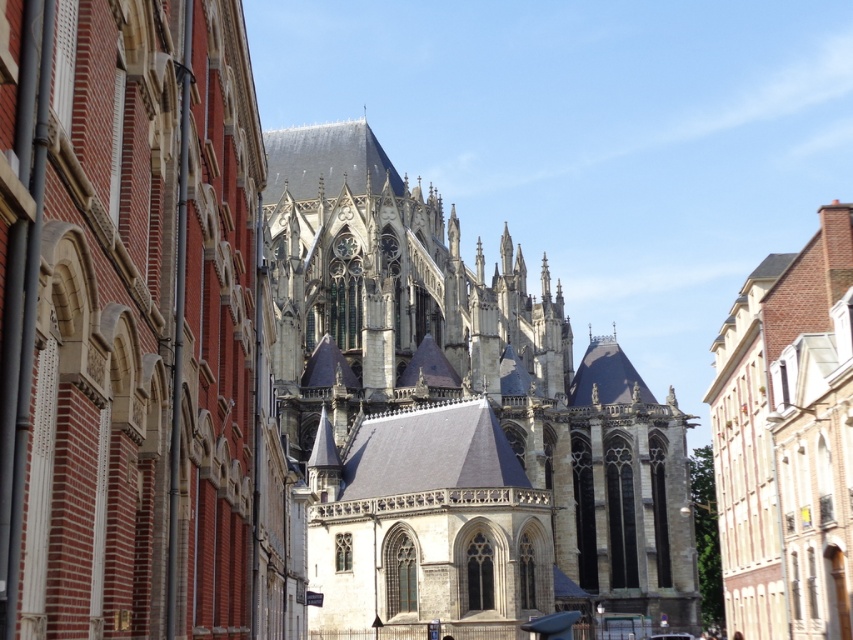
Question: Does dark gray stone church at center come behind brick textured building at right?

Choices:
 (A) no
 (B) yes

Answer: (A)

Question: Does dark gray stone church at center appear on the left side of gray stone church at center?

Choices:
 (A) yes
 (B) no

Answer: (A)

Question: Which point is farther to the camera?

Choices:
 (A) gray stone church at center
 (B) dark gray stone church at center

Answer: (A)

Question: Which point appears farthest from the camera in this image?

Choices:
 (A) (811, 538)
 (B) (389, 420)

Answer: (B)

Question: Which of the following is the closest to the observer?

Choices:
 (A) (844, 374)
 (B) (271, 212)

Answer: (A)

Question: Does gray stone church at center have a lesser width compared to brick textured building at right?

Choices:
 (A) no
 (B) yes

Answer: (A)